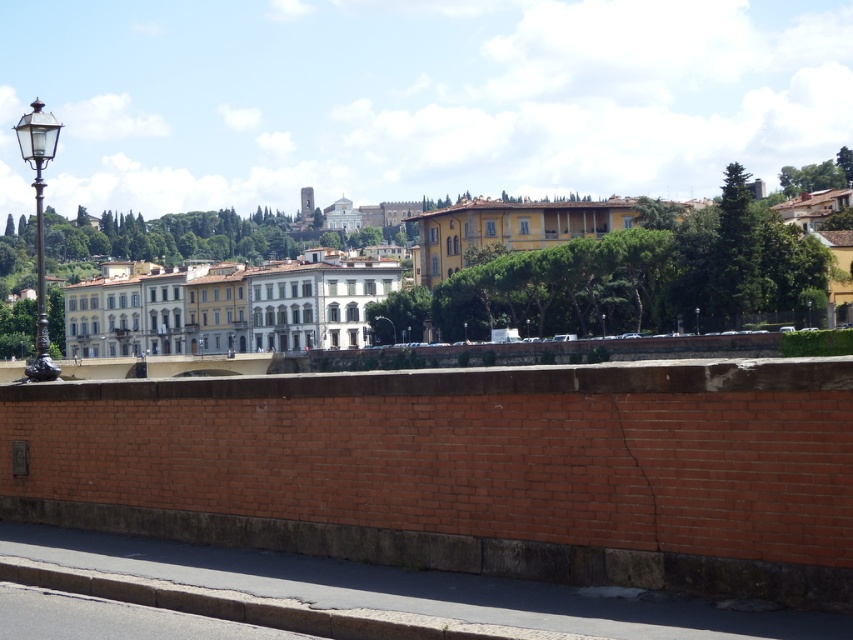
You are a delivery person trying to place a box on the gray concrete curb at lower left. The box is 1.5 times taller than the curb. Will the box be taller than the metallic streetlight at center?

The gray concrete curb at lower left has a lesser height compared to metallic streetlight at center. Since the box is 1.5 times taller than the curb, it would surpass the curb but not necessarily the streetlight. Without knowing the exact heights, we cannot confirm if the box will be taller than the metallic streetlight at center.

You are a delivery driver approaching the gray concrete curb at lower left and the white glossy building at center. Which structure will you encounter first as you drive forward?

You will encounter the gray concrete curb at lower left first because it is closer to you than the white glossy building at center, which is further away.